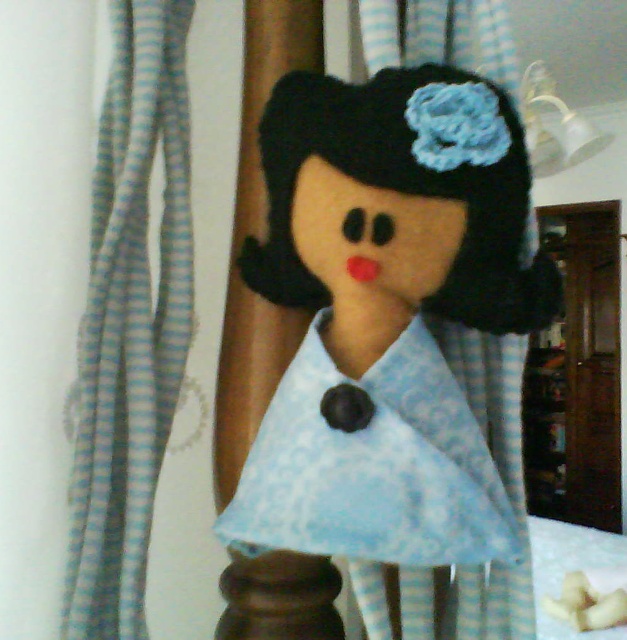
Can you confirm if felt doll at center is positioned to the right of light blue striped fabric at left?

Indeed, felt doll at center is positioned on the right side of light blue striped fabric at left.

Between felt doll at center and light blue striped fabric at left, which one is positioned higher?

light blue striped fabric at left is above.

Who is more forward, [278,83] or [176,120]?

Positioned in front is point [278,83].

Find the location of a particular element. Image resolution: width=627 pixels, height=640 pixels. felt doll at center is located at coordinates (391, 317).